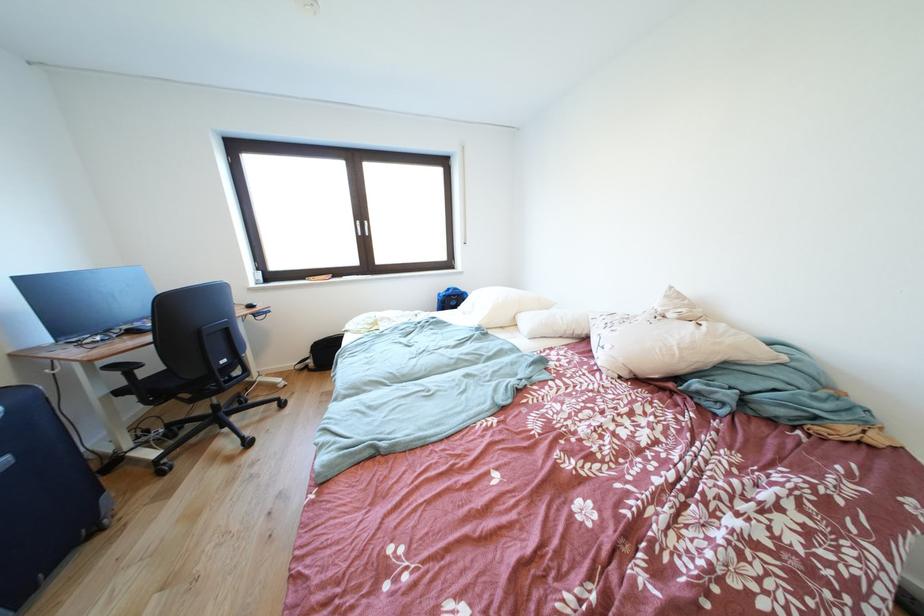
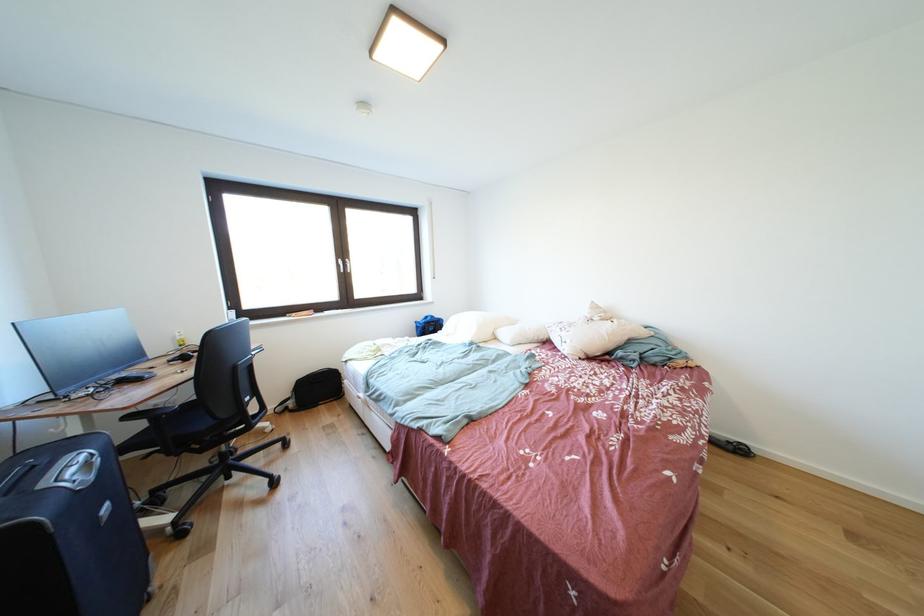
Where in the second image is the point corresponding to pixel 614 337 from the first image?

(572, 338)